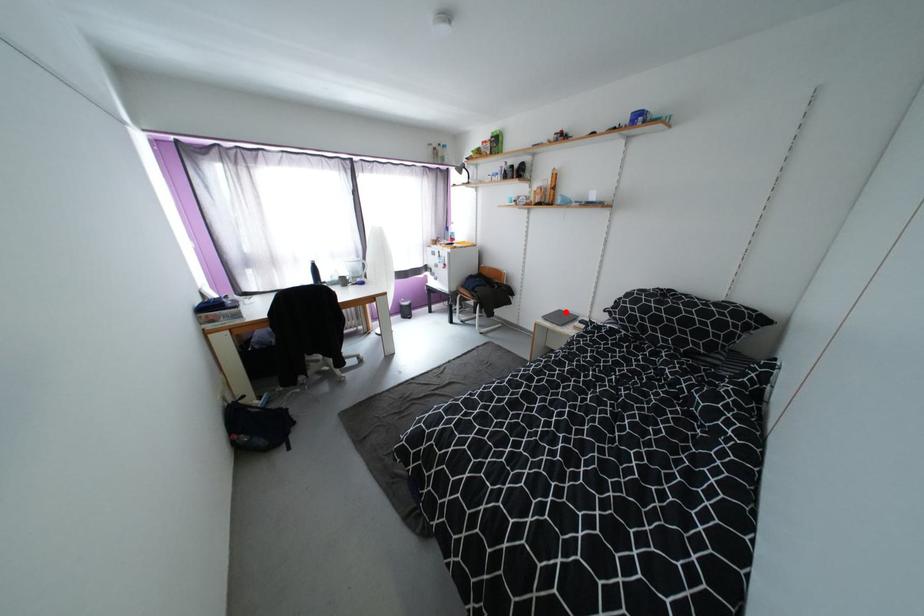
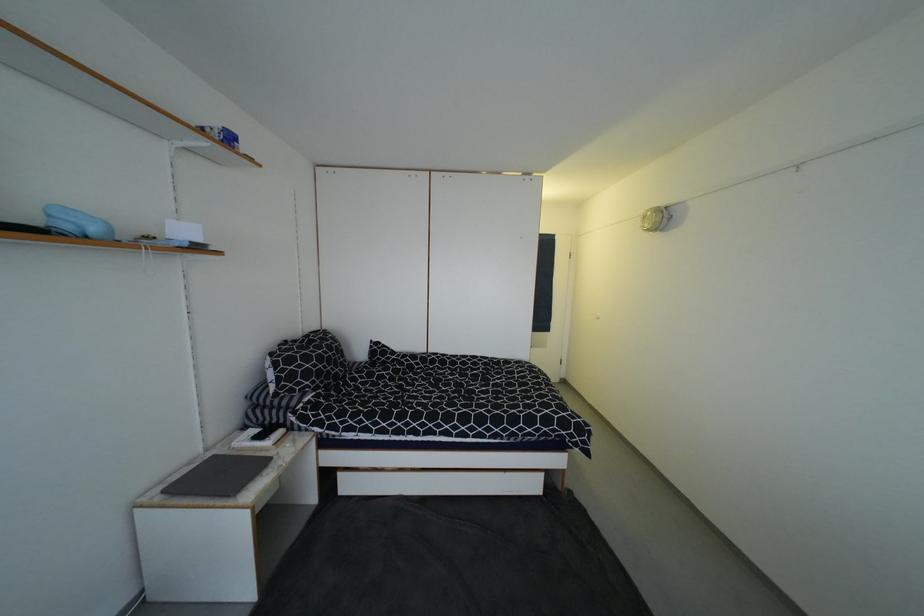
Where in the second image is the point corresponding to the highlighted location from the first image?

(169, 493)